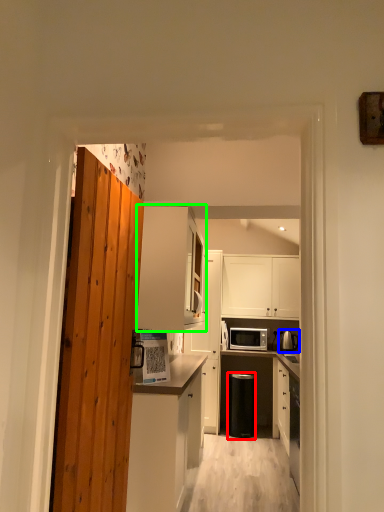
Question: Which object is positioned farthest from appliance (highlighted by a red box)? Select from appliance (highlighted by a blue box) and cabinetry (highlighted by a green box).

Choices:
 (A) appliance
 (B) cabinetry

Answer: (B)